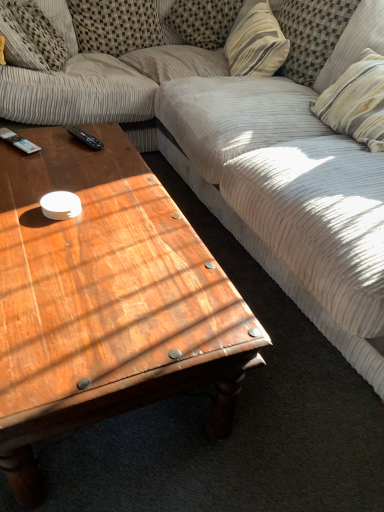
The height and width of the screenshot is (512, 384). What are the coordinates of `checkered fabric pillow at upper left, acting as the 5th pillow starting from the right` in the screenshot? It's located at [x=115, y=25].

What are the coordinates of `black plastic remote at center, which is the 2th remote control in left-to-right order` in the screenshot? It's located at (85, 138).

Measure the distance between point (241, 2) and camera.

Point (241, 2) is 2.45 meters from camera.

Where is `striped fabric pillow at upper center, which is counted as the third pillow, starting from the left`? The image size is (384, 512). striped fabric pillow at upper center, which is counted as the third pillow, starting from the left is located at coordinates coord(202,21).

This screenshot has width=384, height=512. What are the coordinates of `striped fabric pillow at upper right, marked as the 2th pillow in a right-to-left arrangement` in the screenshot? It's located at (311, 35).

This screenshot has width=384, height=512. Describe the element at coordinates (256, 42) in the screenshot. I see `striped fabric pillow at upper center, which appears as the 4th pillow when viewed from the left` at that location.

Locate an element on the screen. checkered fabric pillow at upper left, which is the second pillow in left-to-right order is located at coordinates tap(115, 25).

Which is in front, striped fabric pillow at upper right, which appears as the 6th pillow when viewed from the left, or striped fabric pillow at upper center, which appears as the 4th pillow when viewed from the left?

striped fabric pillow at upper right, which appears as the 6th pillow when viewed from the left, is closer to the camera.

Measure the distance from striped fabric pillow at upper right, which appears as the 6th pillow when viewed from the left, to striped fabric pillow at upper center, the third pillow viewed from the right.

They are 40.45 centimeters apart.

Can you confirm if striped fabric pillow at upper right, acting as the first pillow starting from the right, is positioned to the right of striped fabric pillow at upper center, which appears as the 4th pillow when viewed from the left?

Indeed, striped fabric pillow at upper right, acting as the first pillow starting from the right, is positioned on the right side of striped fabric pillow at upper center, which appears as the 4th pillow when viewed from the left.

Where is `the 2nd pillow below the striped fabric pillow at upper right, which appears as the 6th pillow when viewed from the left (from a real-world perspective)`? the 2nd pillow below the striped fabric pillow at upper right, which appears as the 6th pillow when viewed from the left (from a real-world perspective) is located at coordinates point(256,42).

Is striped fabric pillow at upper right, which is the fifth pillow from left to right, located within black plastic remote control at upper left, the second remote control in the right-to-left sequence?

Actually, striped fabric pillow at upper right, which is the fifth pillow from left to right, is outside black plastic remote control at upper left, the second remote control in the right-to-left sequence.

Considering the relative sizes of black plastic remote control at upper left, the second remote control in the right-to-left sequence, and striped fabric pillow at upper right, which is the fifth pillow from left to right, in the image provided, is black plastic remote control at upper left, the second remote control in the right-to-left sequence, shorter than striped fabric pillow at upper right, which is the fifth pillow from left to right,?

Yes, black plastic remote control at upper left, the second remote control in the right-to-left sequence, is shorter than striped fabric pillow at upper right, which is the fifth pillow from left to right.

Considering the relative positions of black plastic remote control at upper left, the second remote control in the right-to-left sequence, and striped fabric pillow at upper right, which is the fifth pillow from left to right, in the image provided, is black plastic remote control at upper left, the second remote control in the right-to-left sequence, to the right of striped fabric pillow at upper right, which is the fifth pillow from left to right, from the viewer's perspective?

No.

Could you measure the distance between black plastic remote control at upper left, acting as the 1th remote control starting from the left, and striped fabric pillow at upper right, marked as the 2th pillow in a right-to-left arrangement?

They are 4.85 feet apart.

Is point (244, 26) behind point (173, 19)?

No, it is not.

Is striped fabric pillow at upper center, which appears as the 4th pillow when viewed from the left, taller than striped fabric pillow at upper center, which appears as the 4th pillow when viewed from the right?

Yes.

Is point (92, 141) behind point (5, 38)?

No, (92, 141) is closer to viewer.

In the image, is black plastic remote at center, which is the 2th remote control in left-to-right order, on the left side or the right side of textured beige pillow at upper left, the 6th pillow from the right?

In the image, black plastic remote at center, which is the 2th remote control in left-to-right order, appears on the right side of textured beige pillow at upper left, the 6th pillow from the right.

Starting from the textured beige pillow at upper left, acting as the first pillow starting from the left, which remote control is the 1st one in front? Please provide its 2D coordinates.

[(85, 138)]

Is black plastic remote at center, placed as the 1th remote control when sorted from right to left, oriented away from textured beige pillow at upper left, the 6th pillow from the right?

No, textured beige pillow at upper left, the 6th pillow from the right, is not at the back of black plastic remote at center, placed as the 1th remote control when sorted from right to left.

From a real-world perspective, is wooden coffee table at center positioned above or below black plastic remote control at upper left, the second remote control in the right-to-left sequence?

wooden coffee table at center is situated lower than black plastic remote control at upper left, the second remote control in the right-to-left sequence, in the real world.

What's the angular difference between wooden coffee table at center and black plastic remote control at upper left, the second remote control in the right-to-left sequence,'s facing directions?

The angle between the facing direction of wooden coffee table at center and the facing direction of black plastic remote control at upper left, the second remote control in the right-to-left sequence, is 64.2 degrees.

Is wooden coffee table at center looking in the opposite direction of black plastic remote control at upper left, acting as the 1th remote control starting from the left?

No.

Can you confirm if striped fabric pillow at upper center, which appears as the 4th pillow when viewed from the right, is taller than striped fabric pillow at upper right, which is the fifth pillow from left to right?

In fact, striped fabric pillow at upper center, which appears as the 4th pillow when viewed from the right, may be shorter than striped fabric pillow at upper right, which is the fifth pillow from left to right.

From a real-world perspective, which object rests below the other?

striped fabric pillow at upper center, which is counted as the third pillow, starting from the left.

Are striped fabric pillow at upper center, which is counted as the third pillow, starting from the left, and striped fabric pillow at upper right, which is the fifth pillow from left to right, far apart?

No, striped fabric pillow at upper center, which is counted as the third pillow, starting from the left, is not far from striped fabric pillow at upper right, which is the fifth pillow from left to right.

From the image's perspective, is striped fabric pillow at upper center, which is counted as the third pillow, starting from the left, on striped fabric pillow at upper right, marked as the 2th pillow in a right-to-left arrangement?

Correct, striped fabric pillow at upper center, which is counted as the third pillow, starting from the left, appears higher than striped fabric pillow at upper right, marked as the 2th pillow in a right-to-left arrangement, in the image.

Can you tell me how much striped fabric pillow at upper right, which is the fifth pillow from left to right, and black plastic remote control at upper left, acting as the 1th remote control starting from the left, differ in facing direction?

The facing directions of striped fabric pillow at upper right, which is the fifth pillow from left to right, and black plastic remote control at upper left, acting as the 1th remote control starting from the left, are 63.2 degrees apart.

From a real-world perspective, count 1st remote controls downward from the striped fabric pillow at upper right, which is the fifth pillow from left to right, and point to it. Please provide its 2D coordinates.

[(18, 141)]

Based on the photo, from their relative heights in the image, would you say striped fabric pillow at upper right, which is the fifth pillow from left to right, is taller or shorter than black plastic remote control at upper left, acting as the 1th remote control starting from the left?

striped fabric pillow at upper right, which is the fifth pillow from left to right, is taller than black plastic remote control at upper left, acting as the 1th remote control starting from the left.

Considering the positions of objects striped fabric pillow at upper right, marked as the 2th pillow in a right-to-left arrangement, and black plastic remote control at upper left, the second remote control in the right-to-left sequence, in the image provided, who is behind, striped fabric pillow at upper right, marked as the 2th pillow in a right-to-left arrangement, or black plastic remote control at upper left, the second remote control in the right-to-left sequence,?

striped fabric pillow at upper right, marked as the 2th pillow in a right-to-left arrangement, is more distant.

Locate an element on the screen. pillow that is the 4th one when counting downward from the striped fabric pillow at upper center, the third pillow viewed from the right (from the image's perspective) is located at coordinates (354, 42).

This screenshot has width=384, height=512. I want to click on pillow that is the 2nd object located above the black plastic remote control at upper left, the second remote control in the right-to-left sequence (from the image's perspective), so click(x=311, y=35).

Considering their positions, is striped fabric pillow at upper right, which is the fifth pillow from left to right, positioned closer to striped fabric pillow at upper center, which appears as the 4th pillow when viewed from the left, than black plastic remote at center, placed as the 1th remote control when sorted from right to left?

striped fabric pillow at upper right, which is the fifth pillow from left to right, is positioned closer to the anchor striped fabric pillow at upper center, which appears as the 4th pillow when viewed from the left.

Based on their spatial positions, is striped fabric pillow at upper right, marked as the 2th pillow in a right-to-left arrangement, or striped fabric pillow at upper center, the third pillow viewed from the right, closer to striped fabric pillow at upper right, which appears as the 6th pillow when viewed from the left?

Among the two, striped fabric pillow at upper right, marked as the 2th pillow in a right-to-left arrangement, is located nearer to striped fabric pillow at upper right, which appears as the 6th pillow when viewed from the left.

Based on their spatial positions, is wooden coffee table at center or striped fabric pillow at upper right, marked as the 2th pillow in a right-to-left arrangement, further from striped fabric pillow at upper center, which appears as the 4th pillow when viewed from the left?

Based on the image, wooden coffee table at center appears to be further to striped fabric pillow at upper center, which appears as the 4th pillow when viewed from the left.

Which object lies further to the anchor point striped fabric pillow at upper right, which appears as the 6th pillow when viewed from the left, black plastic remote at center, which is the 2th remote control in left-to-right order, or wooden coffee table at center?

wooden coffee table at center.

When comparing their distances from striped fabric pillow at upper center, which appears as the 4th pillow when viewed from the right, does striped fabric pillow at upper right, marked as the 2th pillow in a right-to-left arrangement, or striped fabric pillow at upper center, which appears as the 4th pillow when viewed from the left, seem further?

striped fabric pillow at upper right, marked as the 2th pillow in a right-to-left arrangement, lies further to striped fabric pillow at upper center, which appears as the 4th pillow when viewed from the right, than the other object.

Considering their positions, is textured beige pillow at upper left, acting as the first pillow starting from the left, positioned further to striped fabric pillow at upper right, marked as the 2th pillow in a right-to-left arrangement, than striped fabric pillow at upper right, acting as the first pillow starting from the right?

Among the two, textured beige pillow at upper left, acting as the first pillow starting from the left, is located further to striped fabric pillow at upper right, marked as the 2th pillow in a right-to-left arrangement.

In the scene shown: Considering their positions, is black plastic remote control at upper left, acting as the 1th remote control starting from the left, positioned closer to black plastic remote at center, which is the 2th remote control in left-to-right order, than striped fabric pillow at upper right, acting as the first pillow starting from the right?

black plastic remote control at upper left, acting as the 1th remote control starting from the left, lies closer to black plastic remote at center, which is the 2th remote control in left-to-right order, than the other object.

Which object lies further to the anchor point striped fabric pillow at upper center, which is counted as the third pillow, starting from the left, striped fabric pillow at upper right, acting as the first pillow starting from the right, or wooden coffee table at center?

wooden coffee table at center lies further to striped fabric pillow at upper center, which is counted as the third pillow, starting from the left, than the other object.

The height and width of the screenshot is (512, 384). I want to click on coffee table located between black plastic remote at center, which is the 2th remote control in left-to-right order, and striped fabric pillow at upper right, which appears as the 6th pillow when viewed from the left, in the left-right direction, so click(x=105, y=300).

At what (x,y) coordinates should I click in order to perform the action: click on remote control situated between checkered fabric pillow at upper left, which is the second pillow in left-to-right order, and striped fabric pillow at upper right, which is the fifth pillow from left to right, from left to right. Please return your answer as a coordinate pair (x, y). Looking at the image, I should click on (85, 138).

You are a GUI agent. You are given a task and a screenshot of the screen. Output one action in this format:
    pyautogui.click(x=<x>, y=<y>)
    Task: Click on the pillow between striped fabric pillow at upper right, marked as the 2th pillow in a right-to-left arrangement, and wooden coffee table at center from top to bottom
    Image resolution: width=384 pixels, height=512 pixels.
    Given the screenshot: What is the action you would take?
    pyautogui.click(x=354, y=42)

You are a GUI agent. You are given a task and a screenshot of the screen. Output one action in this format:
    pyautogui.click(x=<x>, y=<y>)
    Task: Click on the coffee table between black plastic remote control at upper left, the second remote control in the right-to-left sequence, and striped fabric pillow at upper right, marked as the 2th pillow in a right-to-left arrangement
    The image size is (384, 512).
    Given the screenshot: What is the action you would take?
    pyautogui.click(x=105, y=300)